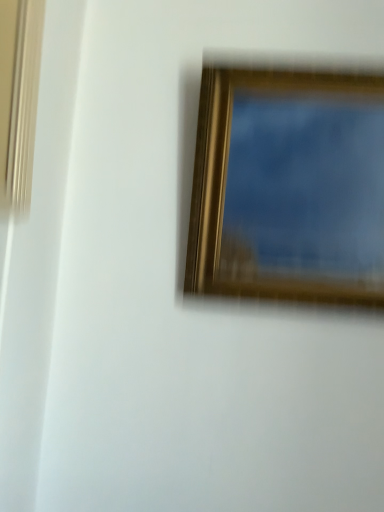
Question: Which direction should I rotate to look at gold metallic picture frame at upper center?

Choices:
 (A) left
 (B) right

Answer: (B)